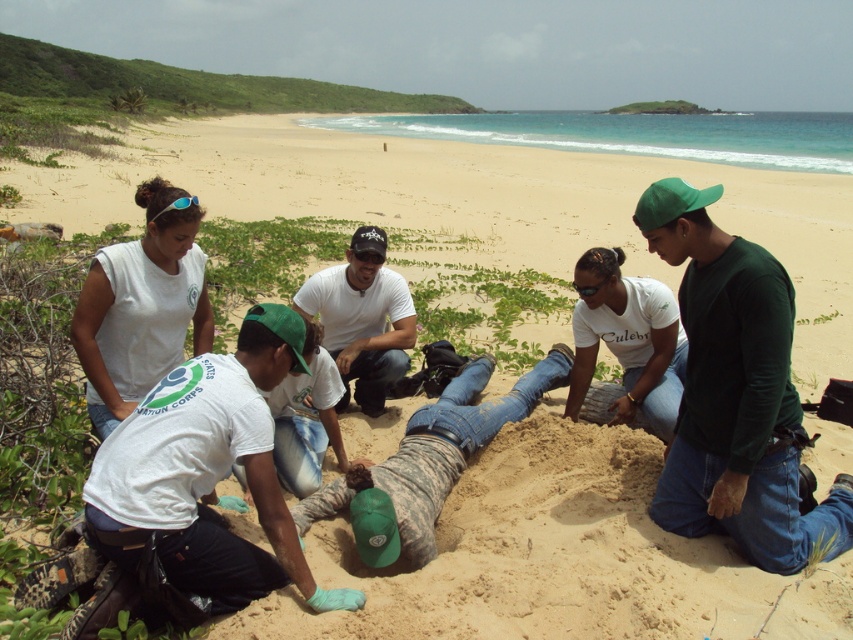
You are a photographer standing on the beach and want to take a photo that includes both the green matte shirt at center and the white cotton shirt at lower left. To ensure both are fully visible in the frame, which person should be positioned closer to the camera?

The white cotton shirt at lower left should be positioned closer to the camera because it is shorter than the green matte shirt at center, allowing both to be fully visible in the photo.

From the picture: You are a photographer trying to capture a photo of the group on the beach. You notice a specific point marked at coordinates (207, 474). Which object in the scene is this point located on?

The point at coordinates (207, 474) is located on the white cotton shirt at lower left.

You are a photographer positioned on the beach and want to capture both the white cotton shirt at lower left and the white matte shirt at center in a single shot. Based on their positions, which shirt will appear closer to the bottom of the photo?

The white cotton shirt at lower left will appear closer to the bottom of the photo because it is located below the white matte shirt at center.